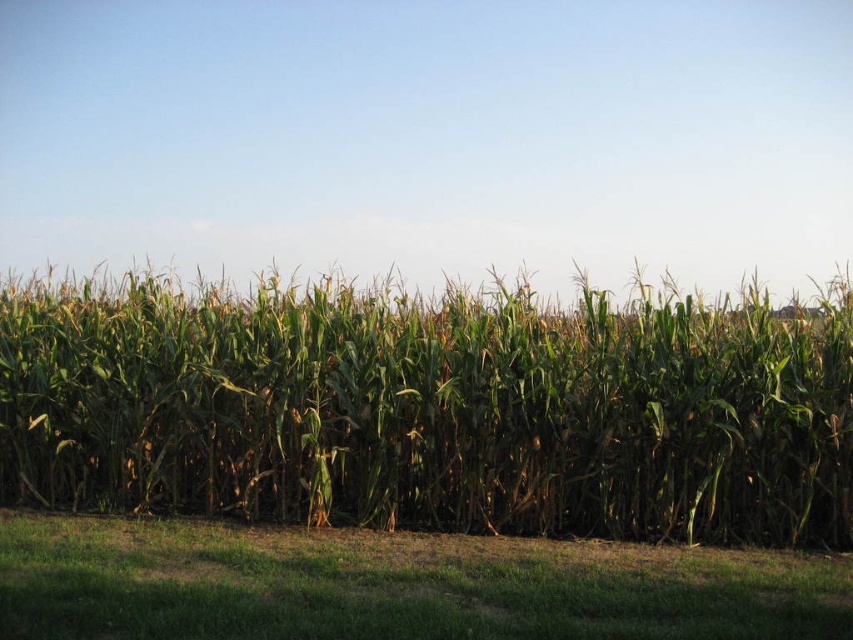
Find the location of `green leafy corn at center`. green leafy corn at center is located at coordinates (428, 410).

Between green leafy corn at center and green grass at lower center, which one appears on the right side from the viewer's perspective?

From the viewer's perspective, green grass at lower center appears more on the right side.

Where is `green leafy corn at center`? green leafy corn at center is located at coordinates (428, 410).